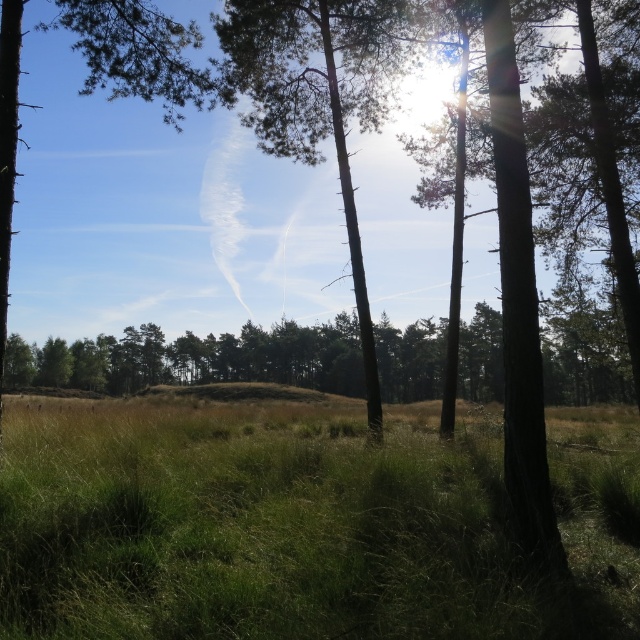
Is green grassy at center to the right of smooth bark tree at center from the viewer's perspective?

Indeed, green grassy at center is positioned on the right side of smooth bark tree at center.

Which of these two, green grassy at center or smooth bark tree at center, stands taller?

smooth bark tree at center is taller.

From the picture: Who is more forward, (112, 525) or (365, 326)?

Point (112, 525)

The width and height of the screenshot is (640, 640). I want to click on green grassy at center, so click(x=300, y=524).